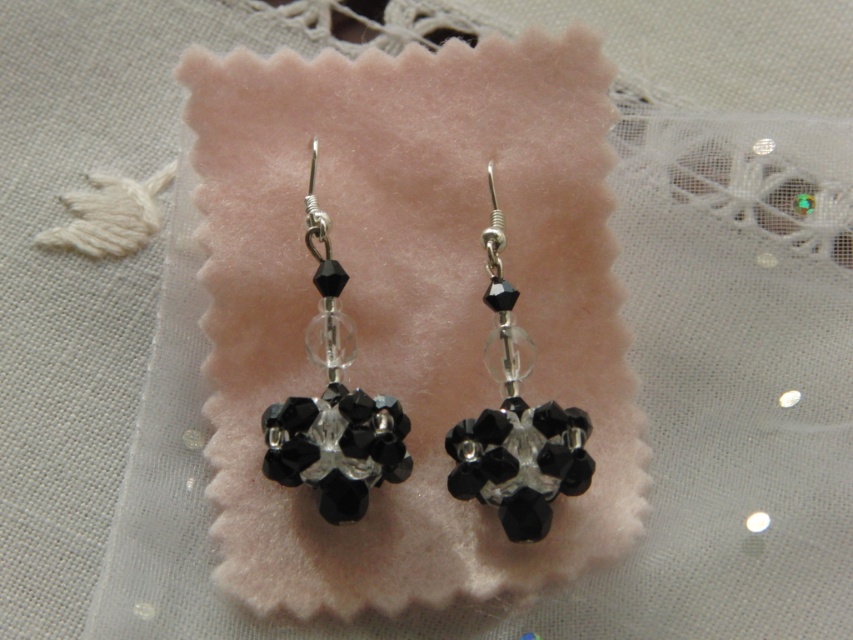
You are a jewelry designer examining the image of the earrings. You need to determine the arrangement of the components. Which object, the black crystal earrings at center or the black crystal cluster at center, is positioned higher up in the image?

The black crystal earrings at center is positioned higher up in the image than the black crystal cluster at center, as the earrings include the cluster as part of their design and are described as much taller.

You are an appraiser examining the earrings. You notice the black crystal earrings at center and the black crystal cluster at center. Which one is positioned higher?

The black crystal earrings at center is located above the black crystal cluster at center, so it is positioned higher.

You are a jewelry designer examining the image of the earrings. You need to determine which object takes up more space between the black crystal earrings at center and the black crystal cluster at center. Which one is it?

The black crystal cluster at center takes up more space than the black crystal earrings at center, as the description states that the black crystal earrings at center occupies less space than the black crystal cluster at center.